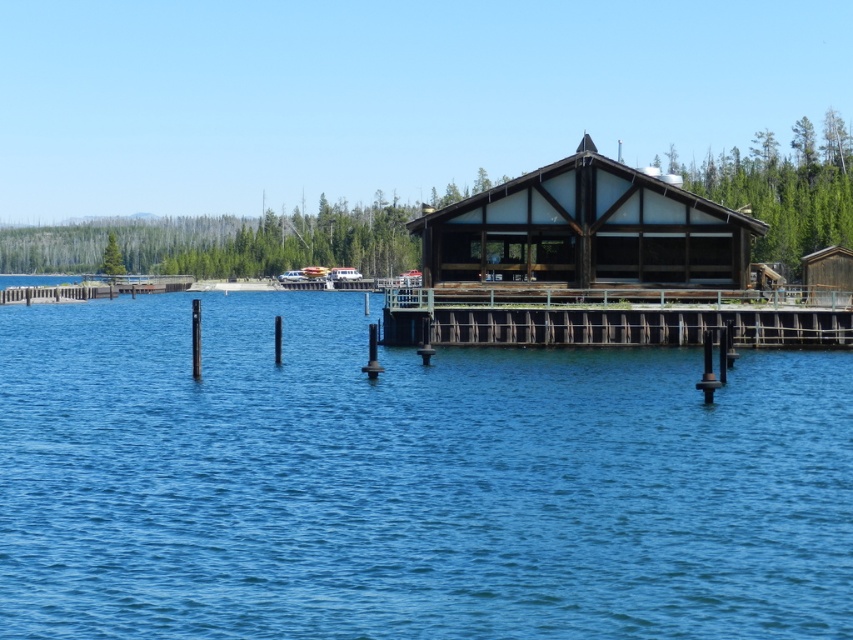
How distant is brown wooden dock at center from metallic silver boat at center?

brown wooden dock at center is 102.58 meters away from metallic silver boat at center.

The image size is (853, 640). What do you see at coordinates (612, 317) in the screenshot?
I see `brown wooden dock at center` at bounding box center [612, 317].

Describe the element at coordinates (612, 317) in the screenshot. I see `brown wooden dock at center` at that location.

The image size is (853, 640). I want to click on brown wooden dock at center, so click(x=612, y=317).

Can you confirm if white plastic boat at center is positioned to the right of metallic silver boat at center?

Indeed, white plastic boat at center is positioned on the right side of metallic silver boat at center.

Which is in front, point (343, 278) or point (296, 273)?

Point (343, 278)

Where is `white plastic boat at center`? The width and height of the screenshot is (853, 640). white plastic boat at center is located at coordinates (344, 273).

In the scene shown: Who is higher up, wooden cabin at center or white plastic boat at center?

wooden cabin at center

At what (x,y) coordinates should I click in order to perform the action: click on wooden cabin at center. Please return your answer as a coordinate pair (x, y). The height and width of the screenshot is (640, 853). Looking at the image, I should click on (585, 230).

Does point (648, 244) come farther from viewer compared to point (352, 268)?

No.

What are the coordinates of `wooden cabin at center` in the screenshot? It's located at (585, 230).